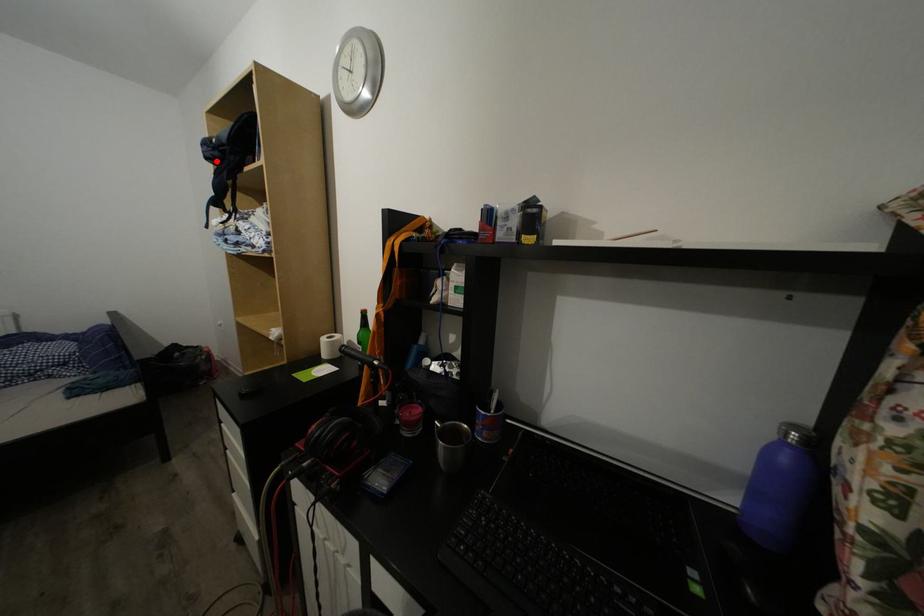
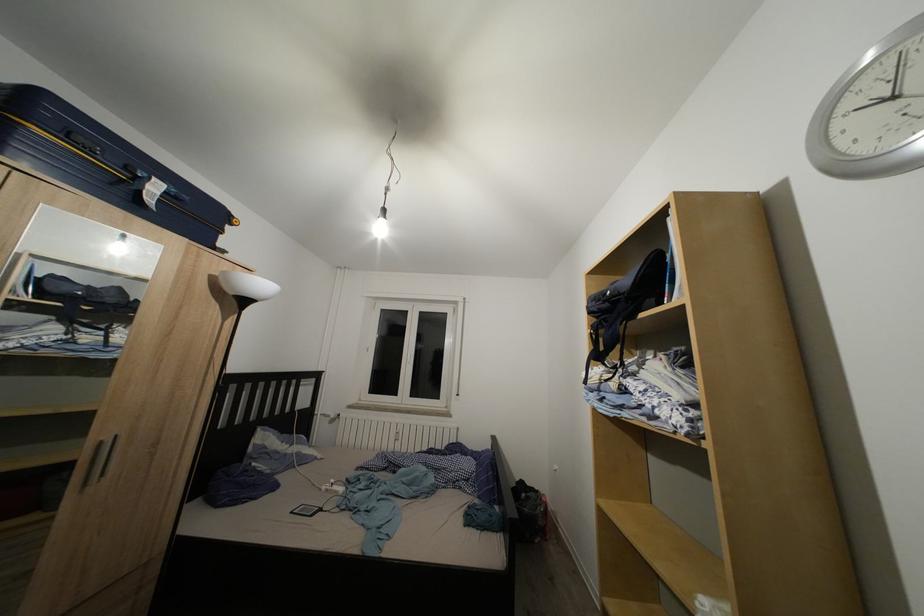
Where in the second image is the point corresponding to the highlighted location from the first image?

(602, 315)